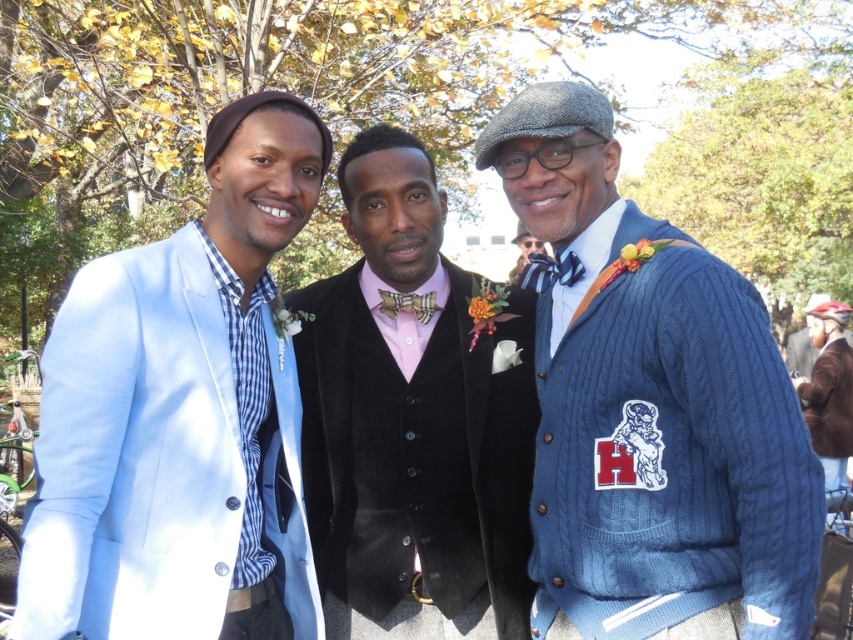
Between pink velvet vest at center and cable knit sweater at center, which one is positioned lower?

pink velvet vest at center

Measure the distance between pink velvet vest at center and cable knit sweater at center.

13.10 meters

Does point (431, 589) come in front of point (543, 243)?

Yes, point (431, 589) is in front of point (543, 243).

The image size is (853, 640). Identify the location of pink velvet vest at center. (412, 420).

Between checkered fabric tie at center and cable knit sweater at center, which one has more height?

Standing taller between the two is cable knit sweater at center.

Is checkered fabric tie at center below cable knit sweater at center?

Correct, checkered fabric tie at center is located below cable knit sweater at center.

This screenshot has height=640, width=853. Describe the element at coordinates (550, 269) in the screenshot. I see `checkered fabric tie at center` at that location.

Image resolution: width=853 pixels, height=640 pixels. In order to click on checkered fabric tie at center in this screenshot , I will do `click(550, 269)`.

Can you confirm if cable knit sweater at right is taller than pink velvet vest at center?

In fact, cable knit sweater at right may be shorter than pink velvet vest at center.

Who is higher up, cable knit sweater at right or pink velvet vest at center?

Positioned higher is cable knit sweater at right.

The image size is (853, 640). I want to click on cable knit sweater at right, so click(650, 410).

The image size is (853, 640). I want to click on cable knit sweater at right, so click(x=650, y=410).